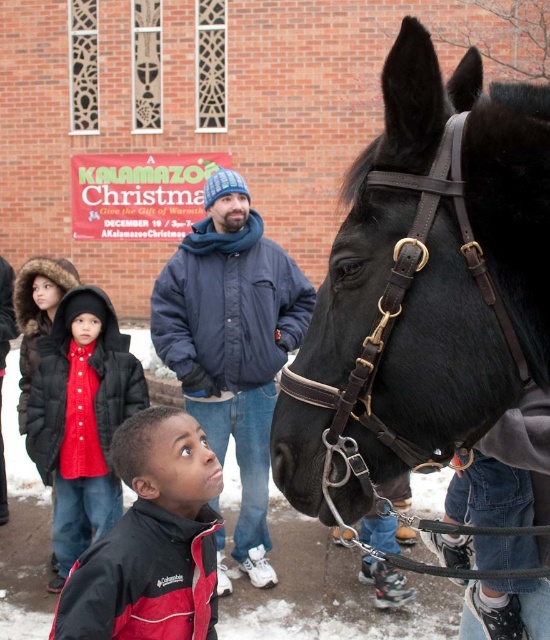
Is point (190, 634) positioned before point (63, 440)?

Yes.

Is red jacket at lower left wider than red quilted coat at lower left?

No.

Measure the distance between point (x=134, y=531) and camera.

Point (x=134, y=531) is 12.81 feet from camera.

Where is `red jacket at lower left`? red jacket at lower left is located at coordinates (151, 540).

You are a GUI agent. You are given a task and a screenshot of the screen. Output one action in this format:
    pyautogui.click(x=<x>, y=<y>)
    Task: Click on the black leather horse at center
    This screenshot has width=550, height=640.
    Given the screenshot: What is the action you would take?
    pyautogui.click(x=424, y=285)

Which is more to the right, black leather horse at center or red jacket at lower left?

Positioned to the right is black leather horse at center.

Is point (393, 474) positioned before point (156, 516)?

That is True.

Image resolution: width=550 pixels, height=640 pixels. What are the coordinates of `black leather horse at center` in the screenshot? It's located at (424, 285).

Who is more distant from viewer, (314,340) or (82,288)?

The point (82,288) is behind.

Can you confirm if black leather horse at center is thinner than red quilted coat at lower left?

Correct, black leather horse at center's width is less than red quilted coat at lower left's.

Does point (348, 474) come closer to viewer compared to point (66, 564)?

Yes.

Find the location of a particular element. black leather horse at center is located at coordinates (424, 285).